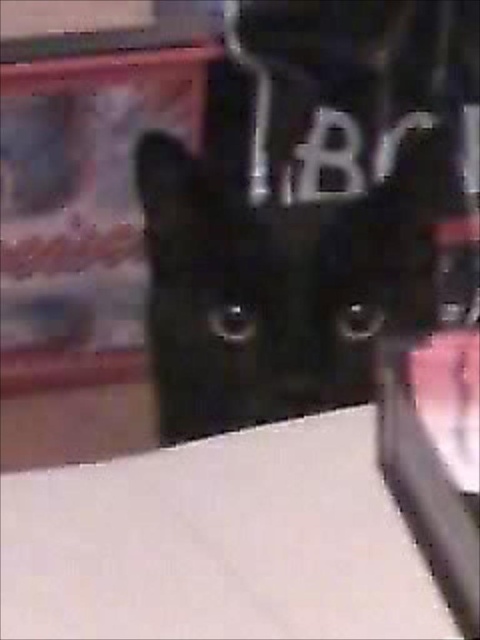
Question: Does white matte table at lower left appear over black glossy cat at center?

Choices:
 (A) yes
 (B) no

Answer: (B)

Question: Is white matte table at lower left closer to camera compared to black glossy cat at center?

Choices:
 (A) yes
 (B) no

Answer: (A)

Question: Which point is closer to the camera?

Choices:
 (A) white matte table at lower left
 (B) black glossy cat at center

Answer: (A)

Question: Which object is closer to the camera taking this photo?

Choices:
 (A) black glossy cat at center
 (B) white matte table at lower left

Answer: (B)

Question: Can you confirm if white matte table at lower left is positioned above black glossy cat at center?

Choices:
 (A) yes
 (B) no

Answer: (B)